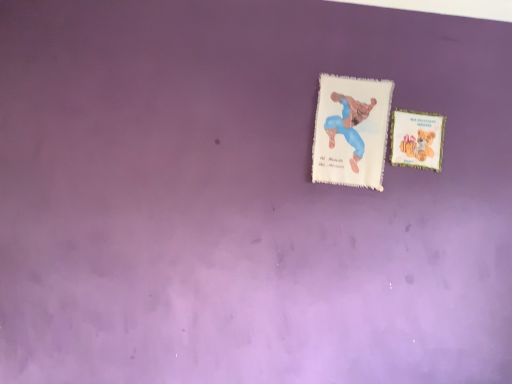
Question: Can you confirm if matte paper card at right, marked as the 2th card in a left-to-right arrangement, is positioned to the right of white felt card at upper center, arranged as the first card when viewed from the left?

Choices:
 (A) no
 (B) yes

Answer: (B)

Question: Is matte paper card at right, which is counted as the 1th card, starting from the right, positioned behind white felt card at upper center, placed as the 2th card when sorted from right to left?

Choices:
 (A) no
 (B) yes

Answer: (B)

Question: From a real-world perspective, is matte paper card at right, which is counted as the 1th card, starting from the right, beneath white felt card at upper center, placed as the 2th card when sorted from right to left?

Choices:
 (A) no
 (B) yes

Answer: (A)

Question: Does matte paper card at right, which is counted as the 1th card, starting from the right, have a lesser width compared to white felt card at upper center, placed as the 2th card when sorted from right to left?

Choices:
 (A) yes
 (B) no

Answer: (A)

Question: Does matte paper card at right, marked as the 2th card in a left-to-right arrangement, have a smaller size compared to white felt card at upper center, placed as the 2th card when sorted from right to left?

Choices:
 (A) yes
 (B) no

Answer: (A)

Question: Is there a large distance between matte paper card at right, which is counted as the 1th card, starting from the right, and white felt card at upper center, placed as the 2th card when sorted from right to left?

Choices:
 (A) yes
 (B) no

Answer: (B)

Question: Would you say white felt card at upper center, arranged as the first card when viewed from the left, is a long distance from matte paper card at right, which is counted as the 1th card, starting from the right?

Choices:
 (A) yes
 (B) no

Answer: (B)

Question: Can you confirm if white felt card at upper center, arranged as the first card when viewed from the left, is thinner than matte paper card at right, marked as the 2th card in a left-to-right arrangement?

Choices:
 (A) yes
 (B) no

Answer: (B)

Question: Could you tell me if white felt card at upper center, arranged as the first card when viewed from the left, is facing matte paper card at right, which is counted as the 1th card, starting from the right?

Choices:
 (A) no
 (B) yes

Answer: (A)

Question: Can you confirm if white felt card at upper center, placed as the 2th card when sorted from right to left, is positioned to the left of matte paper card at right, marked as the 2th card in a left-to-right arrangement?

Choices:
 (A) no
 (B) yes

Answer: (B)

Question: Is matte paper card at right, marked as the 2th card in a left-to-right arrangement, located within white felt card at upper center, arranged as the first card when viewed from the left?

Choices:
 (A) no
 (B) yes

Answer: (A)

Question: From a real-world perspective, is white felt card at upper center, arranged as the first card when viewed from the left, on top of matte paper card at right, which is counted as the 1th card, starting from the right?

Choices:
 (A) no
 (B) yes

Answer: (A)

Question: From their relative heights in the image, would you say white felt card at upper center, arranged as the first card when viewed from the left, is taller or shorter than matte paper card at right, marked as the 2th card in a left-to-right arrangement?

Choices:
 (A) tall
 (B) short

Answer: (A)